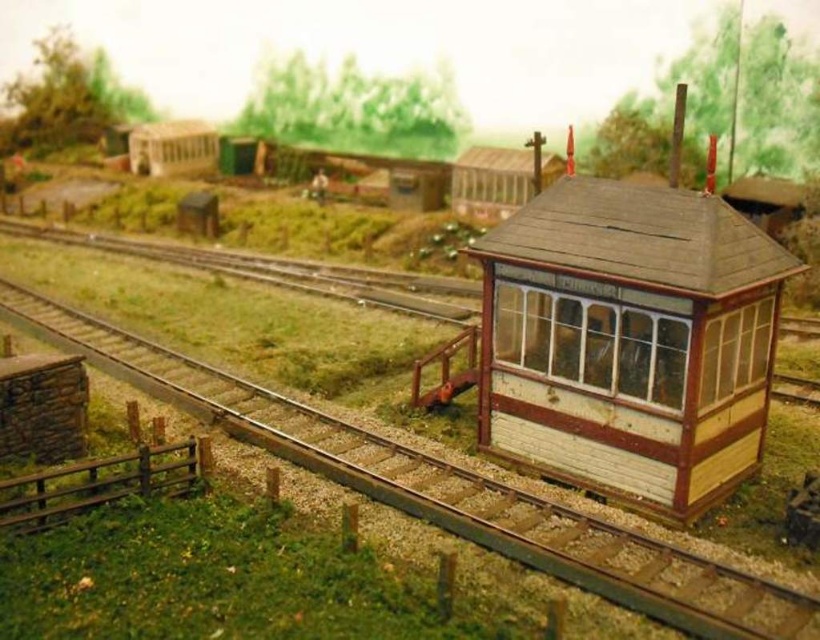
Question: Is wooden signal box at right to the left of brown wooden train track at center from the viewer's perspective?

Choices:
 (A) yes
 (B) no

Answer: (B)

Question: Which point appears farthest from the camera in this image?

Choices:
 (A) coord(468,481)
 (B) coord(574,218)

Answer: (B)

Question: Among these objects, which one is farthest from the camera?

Choices:
 (A) brown wooden train track at center
 (B) wooden signal box at right

Answer: (B)

Question: Is wooden signal box at right above brown wooden train track at center?

Choices:
 (A) no
 (B) yes

Answer: (B)

Question: Does wooden signal box at right appear on the left side of brown wooden train track at center?

Choices:
 (A) yes
 (B) no

Answer: (B)